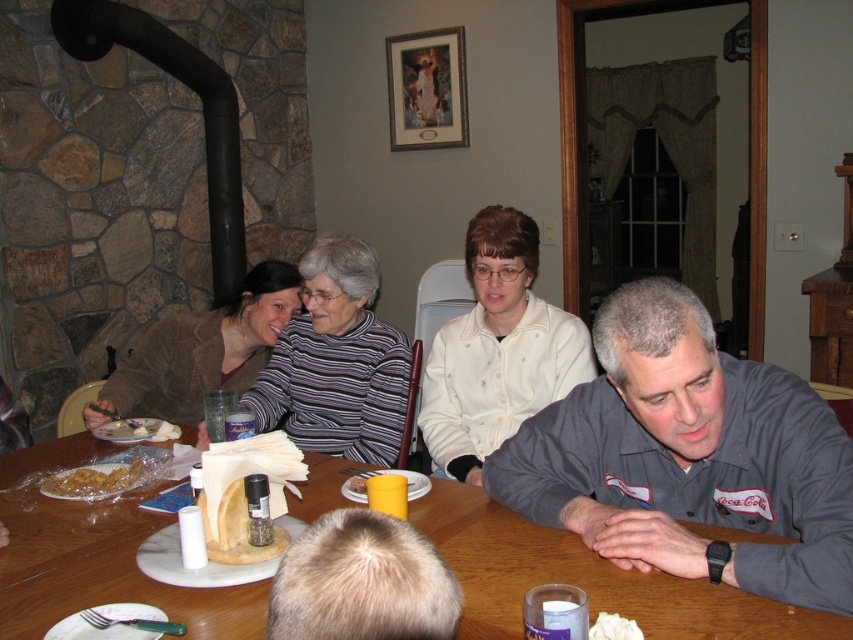
Which is more to the left, white matte jacket at center or golden crispy chicken at lower left?

golden crispy chicken at lower left is more to the left.

Who is more forward, (x=477, y=340) or (x=49, y=490)?

Point (x=49, y=490)

Locate an element on the screen. This screenshot has width=853, height=640. white matte jacket at center is located at coordinates [497, 349].

Between point (606, 584) and point (621, 621), which one is positioned behind?

Positioned behind is point (606, 584).

Does point (843, 618) lie behind point (595, 636)?

Yes, point (843, 618) is behind point (595, 636).

Is point (25, 561) closer to viewer compared to point (618, 632)?

No, (25, 561) is further to viewer.

Locate an element on the screen. Image resolution: width=853 pixels, height=640 pixels. wooden table at center is located at coordinates (585, 579).

Locate an element on the screen. wooden table at center is located at coordinates (585, 579).

Consider the image. Does wooden table at center appear on the right side of white matte jacket at center?

Incorrect, wooden table at center is not on the right side of white matte jacket at center.

Where is `wooden table at center`? wooden table at center is located at coordinates (585, 579).